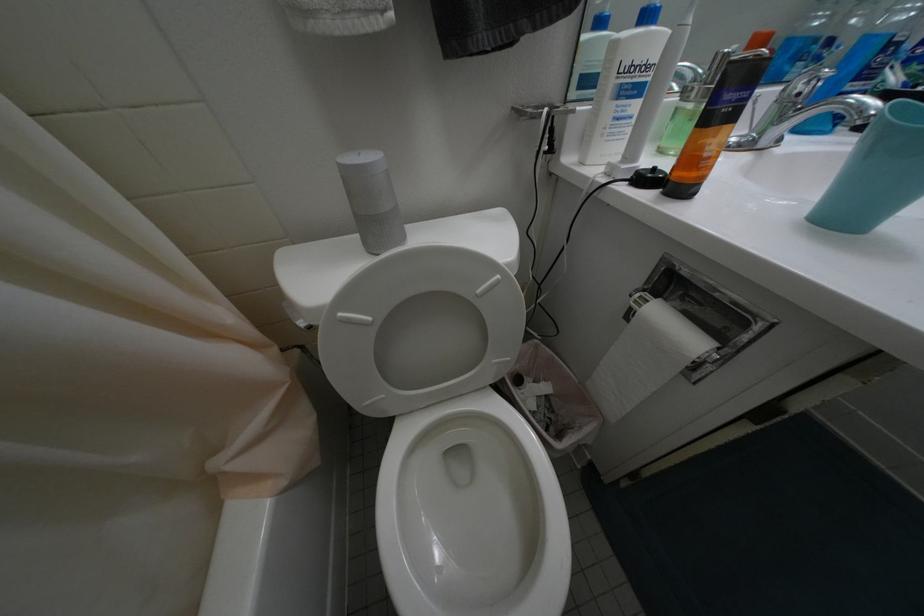
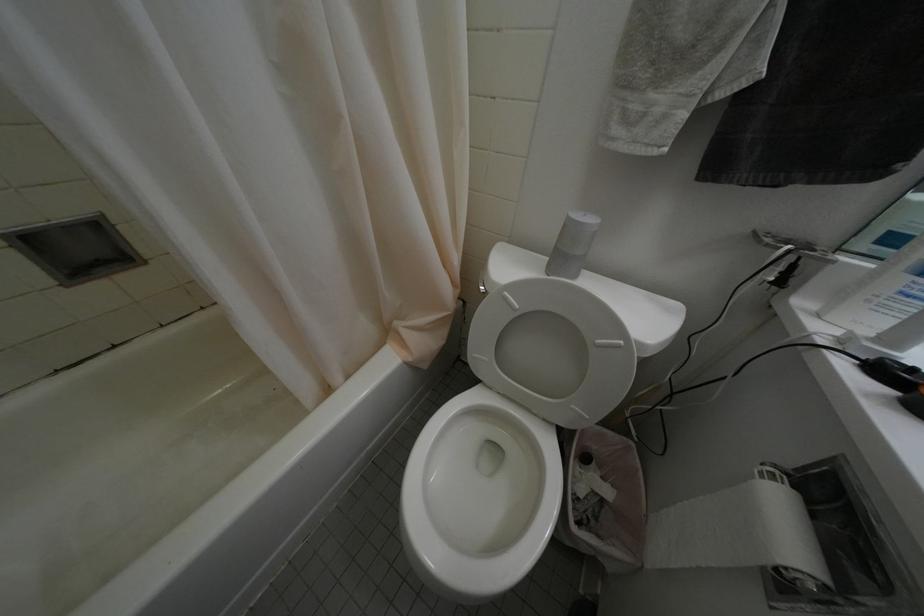
Question: The first image is from the beginning of the video and the second image is from the end. How did the camera likely rotate when shooting the video?

Choices:
 (A) Left
 (B) Right
 (C) Up
 (D) Down

Answer: (A)